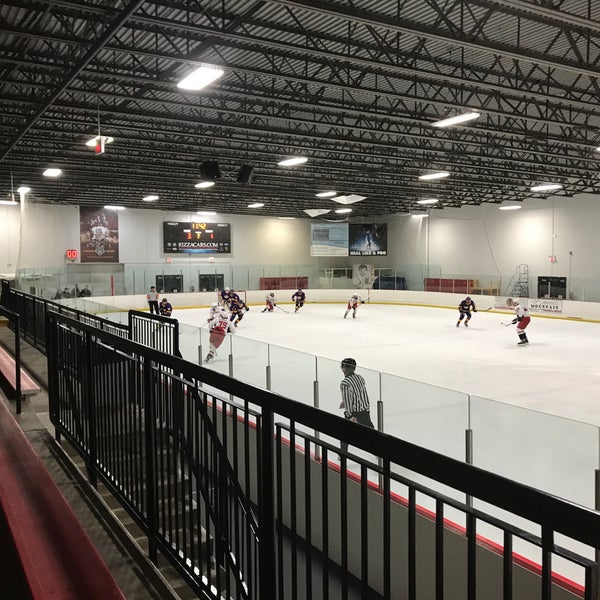
Identify the location of hand rail. The height and width of the screenshot is (600, 600). (137, 427).